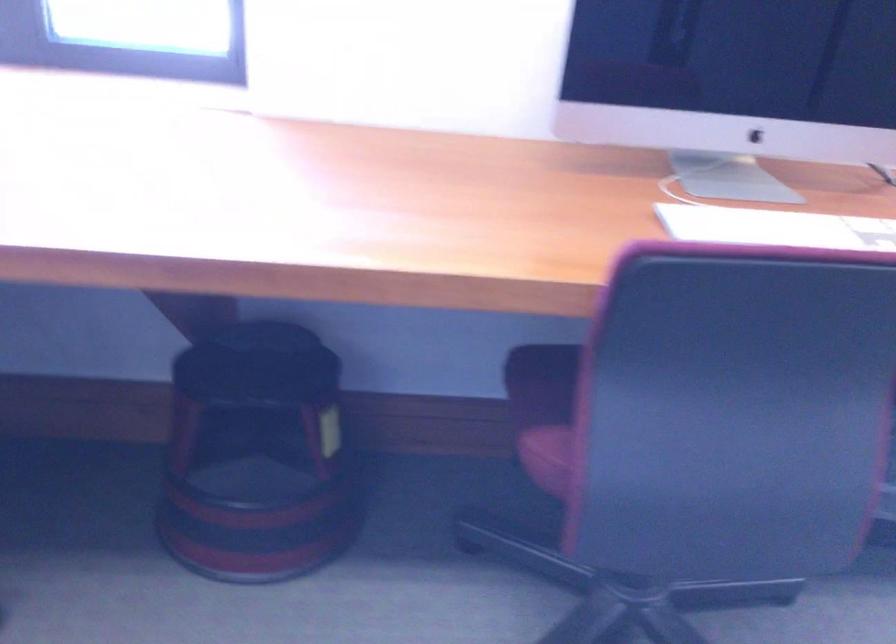
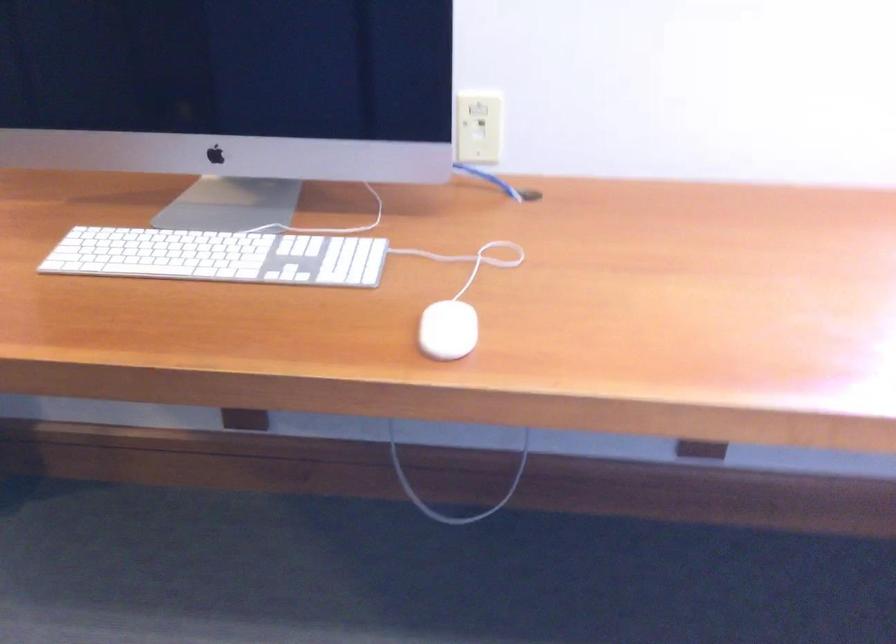
Question: In a continuous first-person perspective shot, in which direction is the camera moving?

Choices:
 (A) Left
 (B) Right
 (C) Forward
 (D) Backward

Answer: (A)